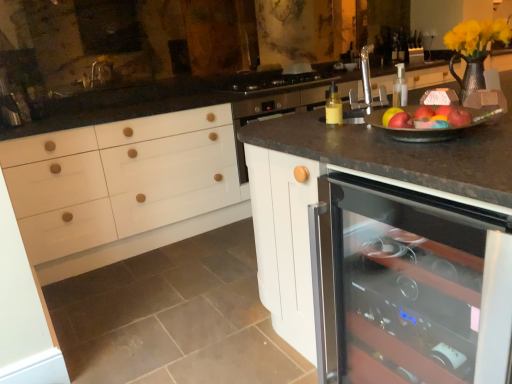
Question: Should I look upward or downward to see black glass gas stove at center?

Choices:
 (A) up
 (B) down

Answer: (A)

Question: From the image's perspective, is transparent glass wine cooler at center on top of black glass gas stove at center?

Choices:
 (A) no
 (B) yes

Answer: (A)

Question: From a real-world perspective, is transparent glass wine cooler at center over black glass gas stove at center?

Choices:
 (A) no
 (B) yes

Answer: (A)

Question: Is transparent glass wine cooler at center at the left side of black glass gas stove at center?

Choices:
 (A) yes
 (B) no

Answer: (B)

Question: Can you confirm if transparent glass wine cooler at center is smaller than black glass gas stove at center?

Choices:
 (A) no
 (B) yes

Answer: (A)

Question: Considering the relative sizes of transparent glass wine cooler at center and black glass gas stove at center in the image provided, is transparent glass wine cooler at center thinner than black glass gas stove at center?

Choices:
 (A) no
 (B) yes

Answer: (A)

Question: Is transparent glass wine cooler at center placed right next to black glass gas stove at center?

Choices:
 (A) yes
 (B) no

Answer: (B)

Question: From a real-world perspective, is red matte apple at upper right, arranged as the first apple when viewed from the left, positioned under transparent glass wine cooler at center based on gravity?

Choices:
 (A) yes
 (B) no

Answer: (B)

Question: Can you confirm if red matte apple at upper right, arranged as the first apple when viewed from the left, is smaller than transparent glass wine cooler at center?

Choices:
 (A) yes
 (B) no

Answer: (A)

Question: Is red matte apple at upper right, the 3th apple viewed from the right, oriented away from transparent glass wine cooler at center?

Choices:
 (A) no
 (B) yes

Answer: (A)

Question: Is red matte apple at upper right, arranged as the first apple when viewed from the left, taller than transparent glass wine cooler at center?

Choices:
 (A) no
 (B) yes

Answer: (A)

Question: Is red matte apple at upper right, arranged as the first apple when viewed from the left, aimed at transparent glass wine cooler at center?

Choices:
 (A) yes
 (B) no

Answer: (B)

Question: From the image's perspective, is red matte apple at upper right, arranged as the first apple when viewed from the left, above transparent glass wine cooler at center?

Choices:
 (A) no
 (B) yes

Answer: (B)

Question: Is black glass gas stove at center at the back of red matte apple at upper right, the 3th apple in the left-to-right sequence?

Choices:
 (A) no
 (B) yes

Answer: (A)